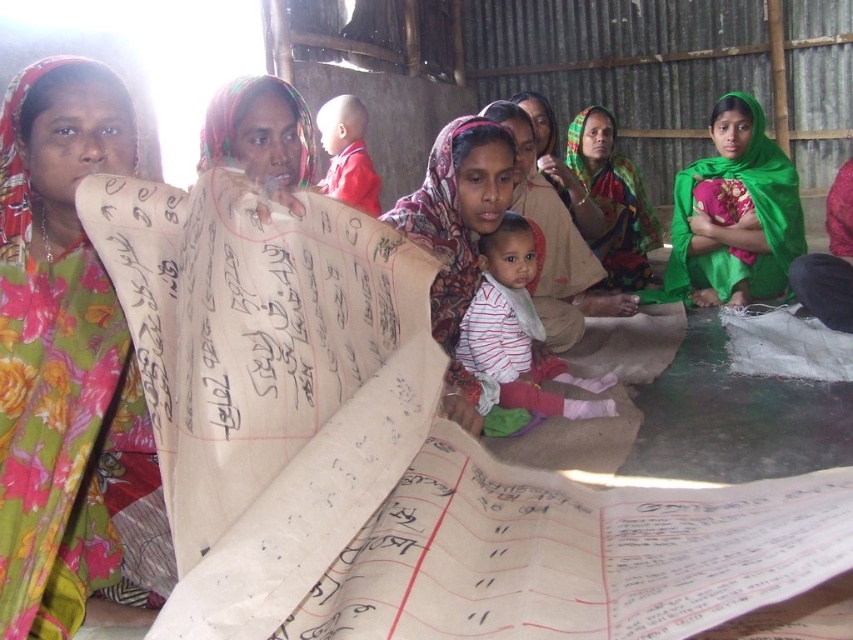
Question: Which of the following is the closest to the observer?

Choices:
 (A) multicolored fabric at center
 (B) striped fabric baby at center
 (C) beige paper scroll at center
 (D) matte pink scarf at center

Answer: (C)

Question: Estimate the real-world distances between objects in this image. Which object is farther from the green satin cloth at right?

Choices:
 (A) beige paper scroll at center
 (B) floral fabric scarf at upper left

Answer: (B)

Question: Does green satin cloth at right appear on the right side of matte pink scarf at center?

Choices:
 (A) yes
 (B) no

Answer: (A)

Question: Can you confirm if beige paper scroll at center is wider than green satin cloth at right?

Choices:
 (A) yes
 (B) no

Answer: (A)

Question: Among these objects, which one is farthest from the camera?

Choices:
 (A) matte pink scarf at center
 (B) striped fabric baby at center

Answer: (B)

Question: Is beige paper scroll at center in front of striped fabric baby at center?

Choices:
 (A) yes
 (B) no

Answer: (A)